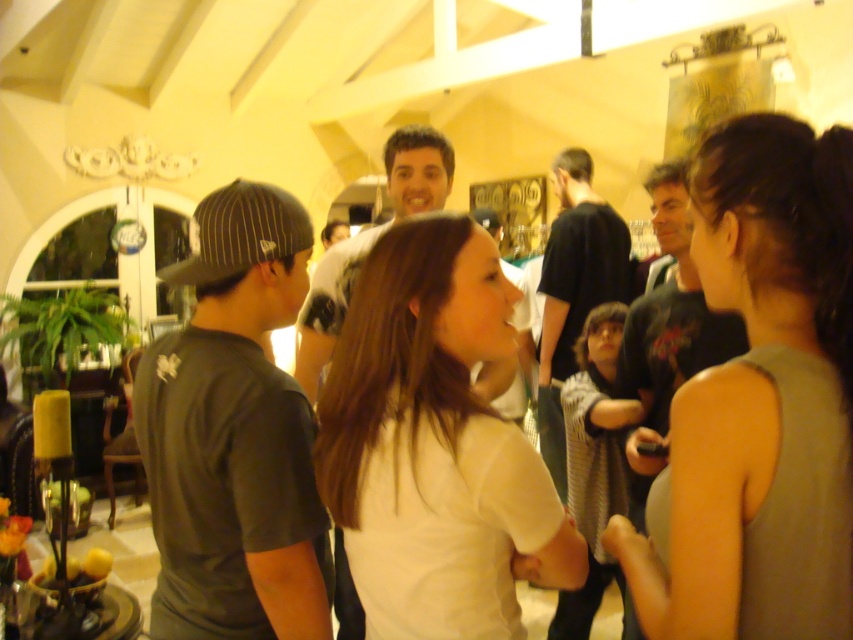
Question: Is matte gray tank top at center to the right of dark gray shirt at center from the viewer's perspective?

Choices:
 (A) yes
 (B) no

Answer: (B)

Question: Does matte gray tank top at center have a lesser width compared to dark green t-shirt at center?

Choices:
 (A) no
 (B) yes

Answer: (B)

Question: Which of the following is the closest to the observer?

Choices:
 (A) (670, 627)
 (B) (598, 248)
 (C) (259, 625)
 (D) (469, 225)

Answer: (A)

Question: Which object appears farthest from the camera in this image?

Choices:
 (A) dark green t-shirt at center
 (B) matte gray tank top at center

Answer: (A)

Question: Which of these objects is positioned farthest from the dark gray shirt at center?

Choices:
 (A) matte gray tank top at center
 (B) dark green t-shirt at center
 (C) white matte shirt at center

Answer: (A)

Question: Can you confirm if matte gray tank top at center is wider than dark gray shirt at center?

Choices:
 (A) yes
 (B) no

Answer: (B)